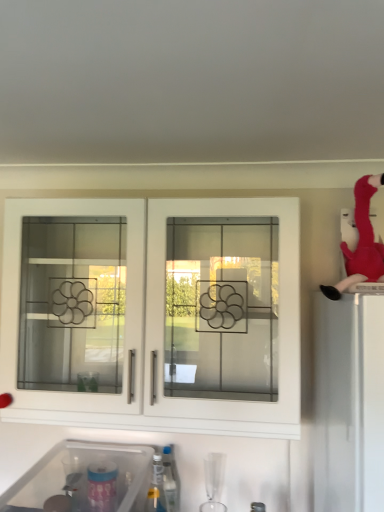
Question: Is transparent plastic sink at lower left completely or partially inside velvet plush flamingo at upper right?

Choices:
 (A) yes
 (B) no

Answer: (B)

Question: From the image's perspective, does velvet plush flamingo at upper right appear higher than transparent plastic sink at lower left?

Choices:
 (A) no
 (B) yes

Answer: (B)

Question: From a real-world perspective, is velvet plush flamingo at upper right beneath transparent plastic sink at lower left?

Choices:
 (A) yes
 (B) no

Answer: (B)

Question: From the image's perspective, is velvet plush flamingo at upper right beneath transparent plastic sink at lower left?

Choices:
 (A) yes
 (B) no

Answer: (B)

Question: Is velvet plush flamingo at upper right positioned in front of transparent plastic sink at lower left?

Choices:
 (A) yes
 (B) no

Answer: (B)

Question: Is velvet plush flamingo at upper right outside of transparent plastic sink at lower left?

Choices:
 (A) no
 (B) yes

Answer: (B)

Question: From the image's perspective, is velvet plush flamingo at upper right over translucent plastic bottle at lower center?

Choices:
 (A) no
 (B) yes

Answer: (B)

Question: From the image's perspective, would you say velvet plush flamingo at upper right is shown under translucent plastic bottle at lower center?

Choices:
 (A) no
 (B) yes

Answer: (A)

Question: Considering the relative positions of velvet plush flamingo at upper right and translucent plastic bottle at lower center in the image provided, is velvet plush flamingo at upper right to the left of translucent plastic bottle at lower center from the viewer's perspective?

Choices:
 (A) no
 (B) yes

Answer: (A)

Question: Is the depth of velvet plush flamingo at upper right less than that of translucent plastic bottle at lower center?

Choices:
 (A) no
 (B) yes

Answer: (B)

Question: Is velvet plush flamingo at upper right facing away from translucent plastic bottle at lower center?

Choices:
 (A) no
 (B) yes

Answer: (A)

Question: Is the position of velvet plush flamingo at upper right more distant than that of translucent plastic bottle at lower center?

Choices:
 (A) yes
 (B) no

Answer: (B)

Question: From a real-world perspective, does translucent plastic bottle at lower center stand above transparent plastic sink at lower left?

Choices:
 (A) no
 (B) yes

Answer: (A)